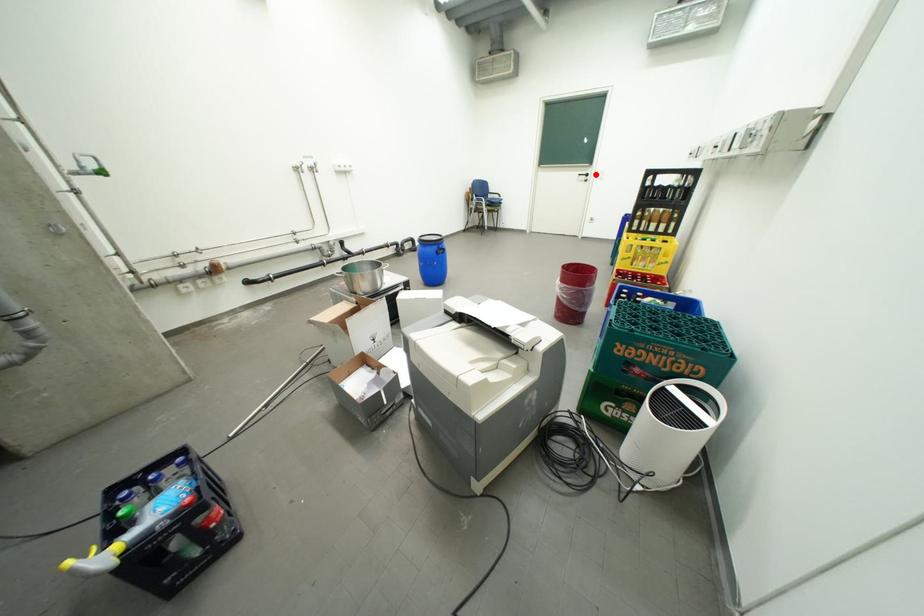
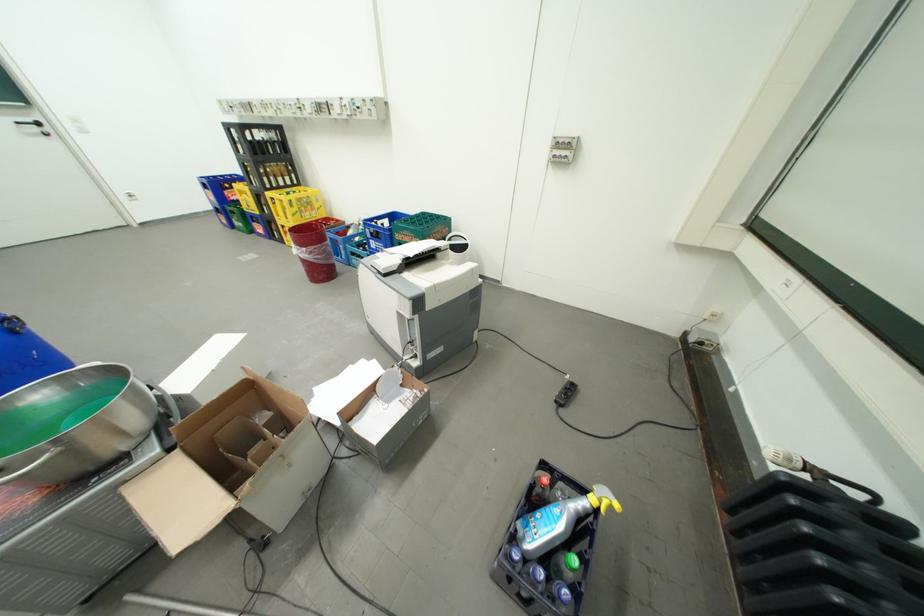
Question: I am providing you with two images of the same scene from different viewpoints. A red point is shown in image1. For the corresponding object point in image2, is it positioned nearer or farther from the camera?

Choices:
 (A) Nearer
 (B) Farther

Answer: (B)